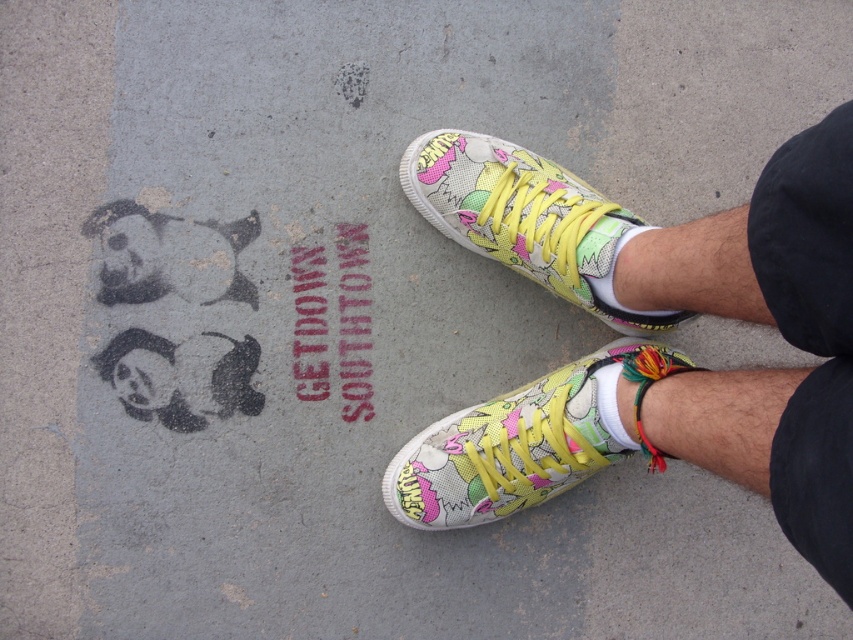
Looking at this image, you are a photographer trying to capture the graffiti artwork on the ground. You notice the multicolored fabric sneaker at lower center and the multicolored fabric sneaker at center are blocking your view. Which sneaker do you need to move to get a clear shot of the graffiti?

The multicolored fabric sneaker at lower center is positioned under the multicolored fabric sneaker at center, so you need to move the multicolored fabric sneaker at lower center to get a clear shot of the graffiti.

You are a photographer trying to capture the stencil graffiti artwork on the ground. You notice the matte canvas sneakers at center and the multicolored fabric sneaker at lower center are blocking part of the artwork. Which sneaker is covering more of the graffiti?

The matte canvas sneakers at center is positioned over multicolored fabric sneaker at lower center, so it is covering more of the graffiti artwork.

You are standing in the scene and notice the multicolored fabric sneaker at center. Where exactly is it positioned relative to the stencil graffiti artwork on the ground?

The multicolored fabric sneaker at center is located at point coordinates approximately 0.344 along the horizontal axis and 0.619 along the vertical axis, which places it centrally in the image, likely above the stencil graffiti artwork described as being next to the feet.